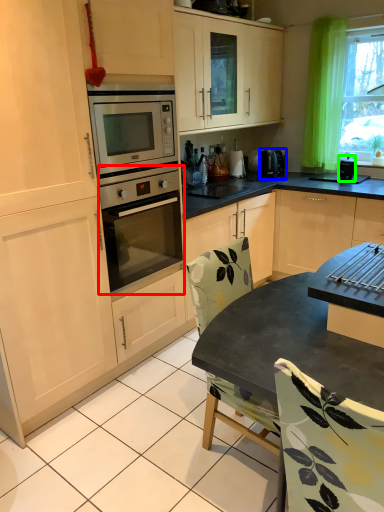
Question: Which is nearer to the oven (highlighted by a red box)? kitchen appliance (highlighted by a blue box) or appliance (highlighted by a green box).

Choices:
 (A) kitchen appliance
 (B) appliance

Answer: (A)